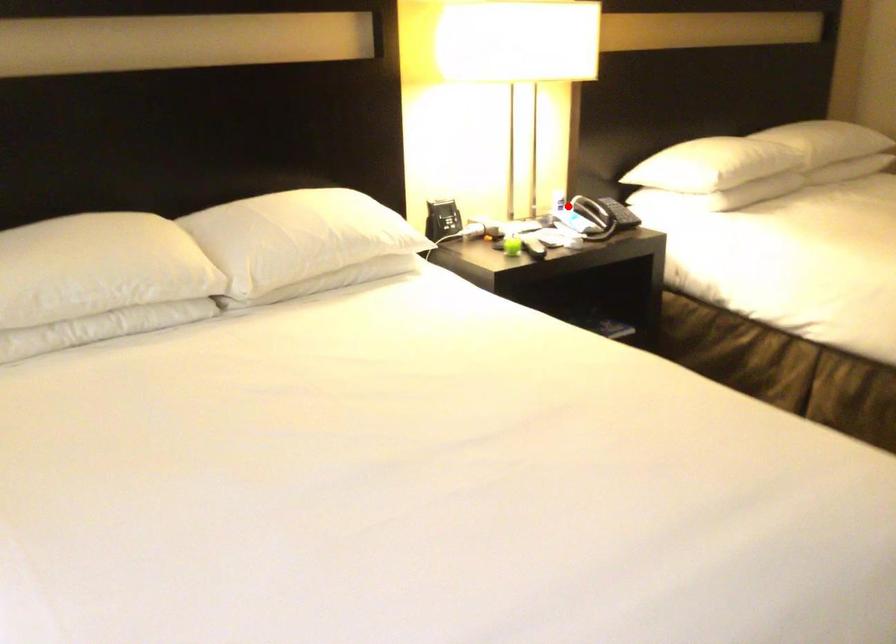
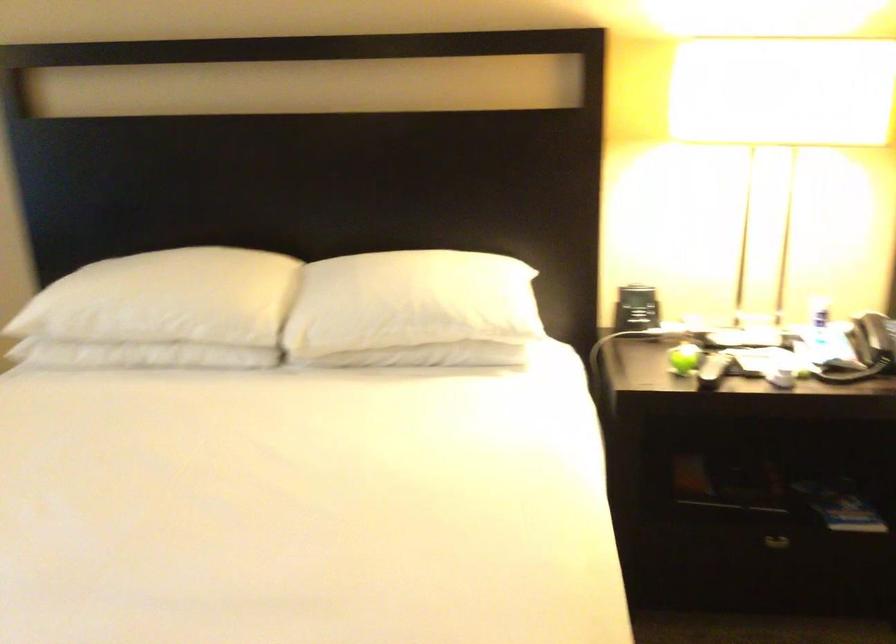
Find the pixel in the second image that matches the highlighted location in the first image.

(819, 319)